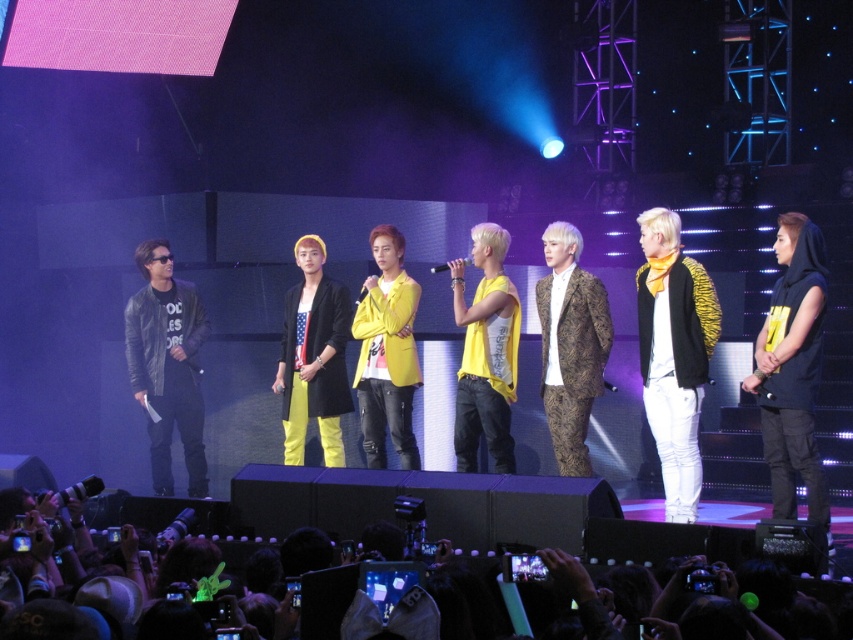
You are a photographer at the concert, and you need to capture a photo of both the point at (x=700, y=268) and the point at (x=160, y=349) in the same frame. Based on their positions, which point is closer to the camera?

Point at (x=700, y=268) is closer to the camera because it is in front of point at .548, 0.188.

You are a photographer at the concert and want to capture a clear photo of the yellow fabric jacket at center without the black fabric crowd at lower center blocking it. Is this possible given their positions?

The yellow fabric jacket at center is positioned over the black fabric crowd at lower center, so taking a clear photo without the crowd blocking it would be difficult as the jacket is in front of the crowd.

You are a stagehand who needs to move a 10 feet long equipment from the backstage to the stage. The equipment must be placed between the yellow fabric jacket at center and the black fabric crowd at lower center. Is there enough space between them to place the equipment?

The distance between the yellow fabric jacket at center and the black fabric crowd at lower center is 11.35 feet, which is greater than the 10 feet length of the equipment. Therefore, there is sufficient space to place the equipment between them.